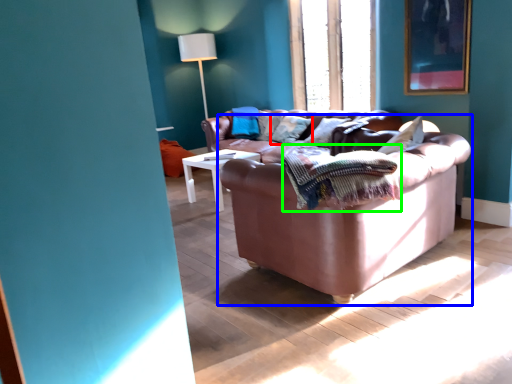
Question: Which object is the closest to the pillow (highlighted by a red box)? Choose among these: studio couch (highlighted by a blue box) or blanket (highlighted by a green box).

Choices:
 (A) studio couch
 (B) blanket

Answer: (A)